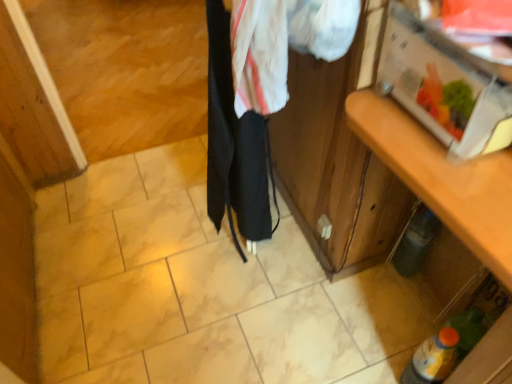
Question: Could you tell me if black fabric at center is turned towards wooden cabinet at right?

Choices:
 (A) yes
 (B) no

Answer: (B)

Question: Is wooden cabinet at right completely or partially inside black fabric at center?

Choices:
 (A) no
 (B) yes

Answer: (A)

Question: Is black fabric at center looking in the opposite direction of wooden cabinet at right?

Choices:
 (A) no
 (B) yes

Answer: (A)

Question: Is black fabric at center shorter than wooden cabinet at right?

Choices:
 (A) no
 (B) yes

Answer: (A)

Question: Is black fabric at center at the right side of wooden cabinet at right?

Choices:
 (A) yes
 (B) no

Answer: (B)

Question: In the image, is black fabric at center positioned in front of or behind green matte bottle at lower right, which is counted as the second bottle, starting from the bottom?

Choices:
 (A) behind
 (B) front

Answer: (B)

Question: Considering the positions of point click(258, 160) and point click(415, 264), is point click(258, 160) closer or farther from the camera than point click(415, 264)?

Choices:
 (A) closer
 (B) farther

Answer: (A)

Question: In terms of size, does black fabric at center appear bigger or smaller than green matte bottle at lower right, which is the 1th bottle in back-to-front order?

Choices:
 (A) big
 (B) small

Answer: (A)

Question: In the image, is black fabric at center on the left side or the right side of green matte bottle at lower right, which is the first bottle from top to bottom?

Choices:
 (A) right
 (B) left

Answer: (B)

Question: From a real-world perspective, is wooden cabinet at right above or below green matte bottle at lower right, which is the 1th bottle in back-to-front order?

Choices:
 (A) above
 (B) below

Answer: (A)

Question: Visually, is wooden cabinet at right positioned to the left or to the right of green matte bottle at lower right, which is counted as the second bottle, starting from the bottom?

Choices:
 (A) right
 (B) left

Answer: (B)

Question: Considering the positions of wooden cabinet at right and green matte bottle at lower right, the 2th bottle when ordered from front to back, in the image, is wooden cabinet at right wider or thinner than green matte bottle at lower right, the 2th bottle when ordered from front to back,?

Choices:
 (A) wide
 (B) thin

Answer: (A)

Question: In the image, is wooden cabinet at right positioned in front of or behind green matte bottle at lower right, which is counted as the second bottle, starting from the bottom?

Choices:
 (A) front
 (B) behind

Answer: (A)

Question: Is green matte bottle at lower right, which is counted as the second bottle, starting from the bottom, spatially inside black fabric at center, or outside of it?

Choices:
 (A) inside
 (B) outside

Answer: (B)

Question: Is green matte bottle at lower right, which is the 1th bottle in back-to-front order, wider or thinner than black fabric at center?

Choices:
 (A) thin
 (B) wide

Answer: (A)